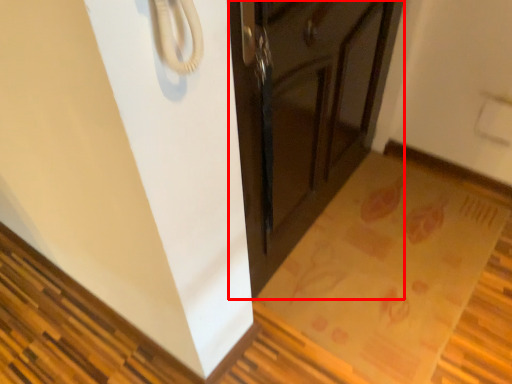
Question: In this image, where is cabinetry (annotated by the red box) located relative to mat?

Choices:
 (A) right
 (B) left

Answer: (B)